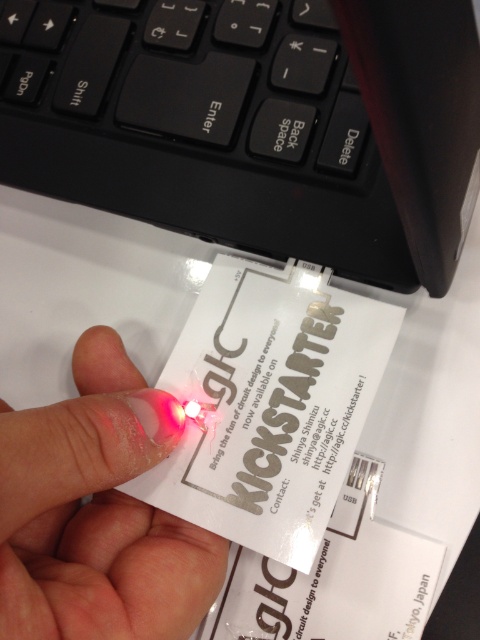
Question: Which object is closer to the camera taking this photo?

Choices:
 (A) transparent plastic at center
 (B) black matte keyboard at upper center

Answer: (A)

Question: Which point appears closest to the camera in this image?

Choices:
 (A) (389, 310)
 (B) (72, 474)

Answer: (B)

Question: Is black matte keyboard at upper center in front of transparent plastic at center?

Choices:
 (A) no
 (B) yes

Answer: (A)

Question: Is black matte keyboard at upper center to the left of white paper at center from the viewer's perspective?

Choices:
 (A) yes
 (B) no

Answer: (A)

Question: Is white paper at center wider than transparent plastic at center?

Choices:
 (A) yes
 (B) no

Answer: (A)

Question: Which point is closer to the camera taking this photo?

Choices:
 (A) (213, 406)
 (B) (141, 88)

Answer: (A)